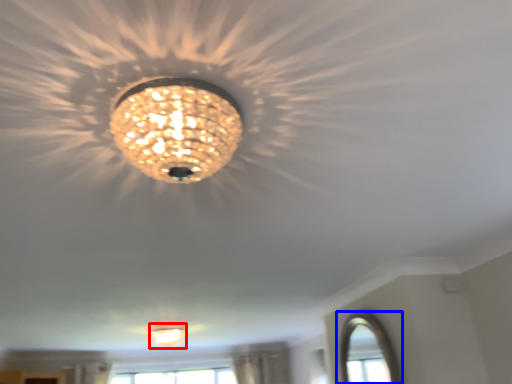
Question: Which object is further to the camera taking this photo, lamp (highlighted by a red box) or window (highlighted by a blue box)?

Choices:
 (A) lamp
 (B) window

Answer: (A)